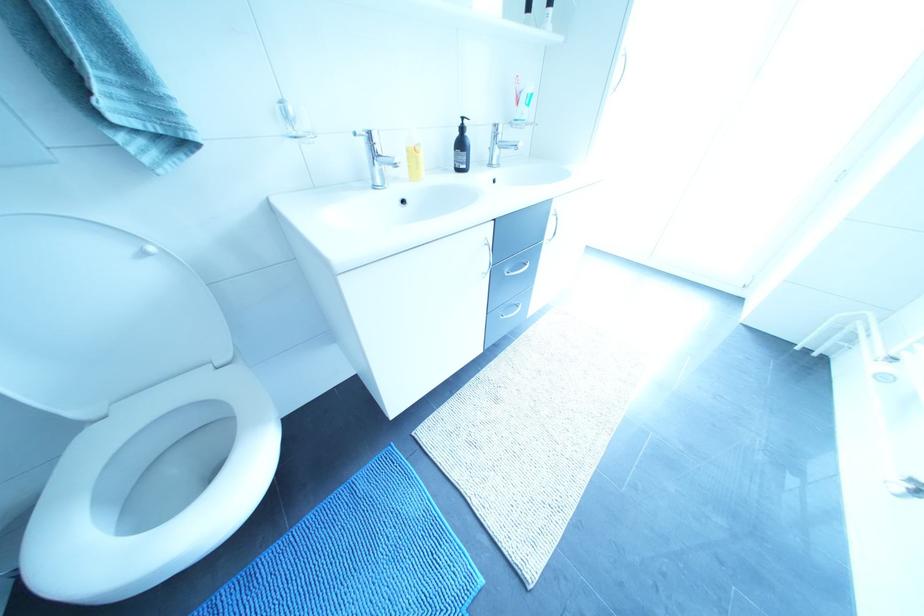
This screenshot has width=924, height=616. What do you see at coordinates (129, 557) in the screenshot?
I see `the white toilet seat` at bounding box center [129, 557].